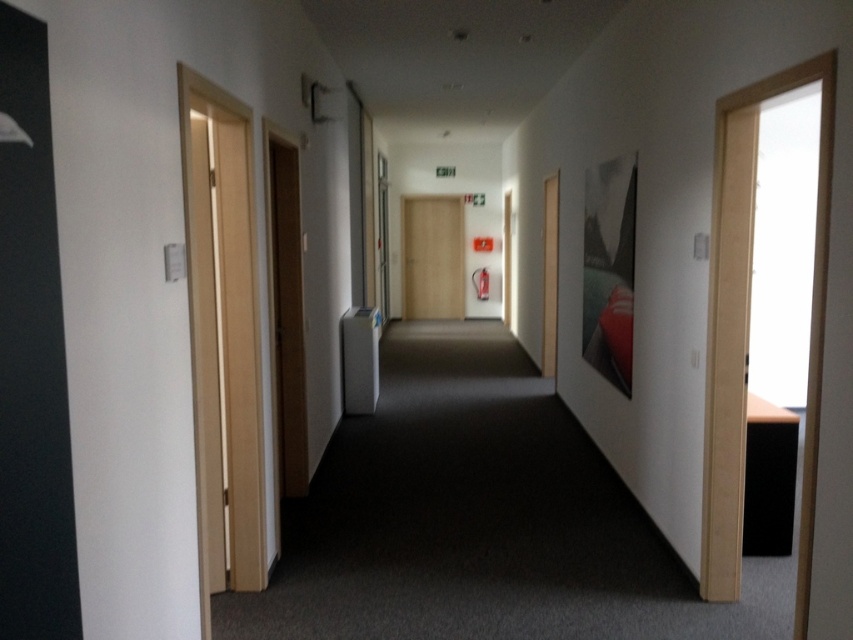
Consider the image. You are navigating through the corridor and need to reach a specific location. You are currently at point (200, 138) and want to get to point (461, 224). Based on the corridor layout described, is the destination point directly behind you or in front of you relative to your current position?

Point (200, 138) is in front of point (461, 224), so the destination point is behind you relative to your current position.

You are a delivery person carrying a large package that requires a door with a minimum width of 3 feet. You see the light wood door at left and the wooden door at center. Which door should you choose to ensure the package fits through?

The light wood door at left has a larger size compared to wooden door at center, so you should choose the light wood door at left to ensure the package fits through.

You are standing at the entrance of the corridor and want to reach the fire extinguisher mounted on the wall near the center. Which door, the light wood door at left or the wooden door at center, is closer to your starting position?

The light wood door at left is closer to your starting position because it is positioned to the left of the wooden door at center, which is further along the corridor.